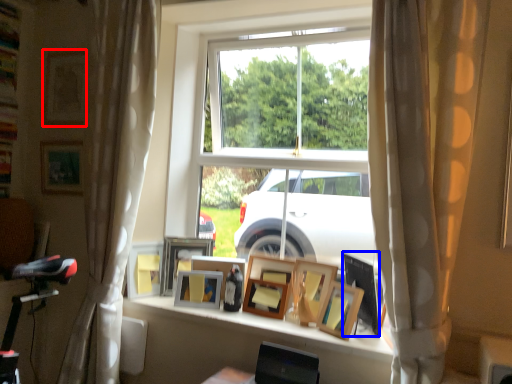
Question: Which point is further to the camera, picture frame (highlighted by a red box) or picture frame (highlighted by a blue box)?

Choices:
 (A) picture frame
 (B) picture frame

Answer: (A)